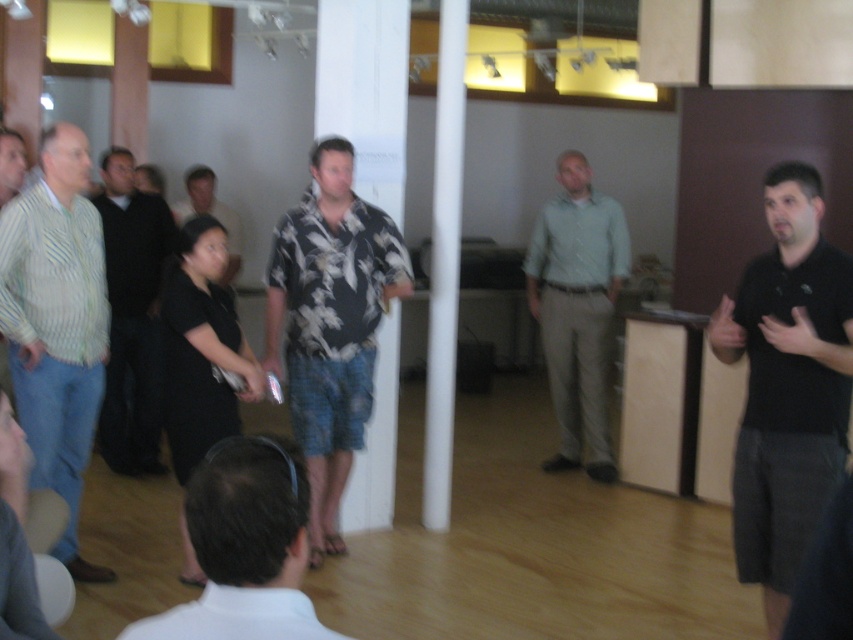
You are standing in the office and see two points marked in the scene. Which point is closer to you? The points are labeled as point [16,243] and point [230,209].

Point [16,243] is in front of point [230,209], so it is closer to you.

Based on the photo, you are organizing a photo shoot and need to ensure that the light green shirt at center and the black shirt at left are visible in the frame. Based on their sizes, which shirt might require more space in the camera frame?

The light green shirt at center requires more space in the camera frame because its width is larger than the black shirt at left.

You are standing in the office space and want to move to the point marked as point (561, 333). If your walking speed is 3 feet per second, how many seconds will it take you to reach there?

The point (561, 333) is 17.73 feet away from the camera. Since you are moving at 3 feet per second, it will take 17.73 divided by 3, which is approximately 5.91 seconds to reach the point.